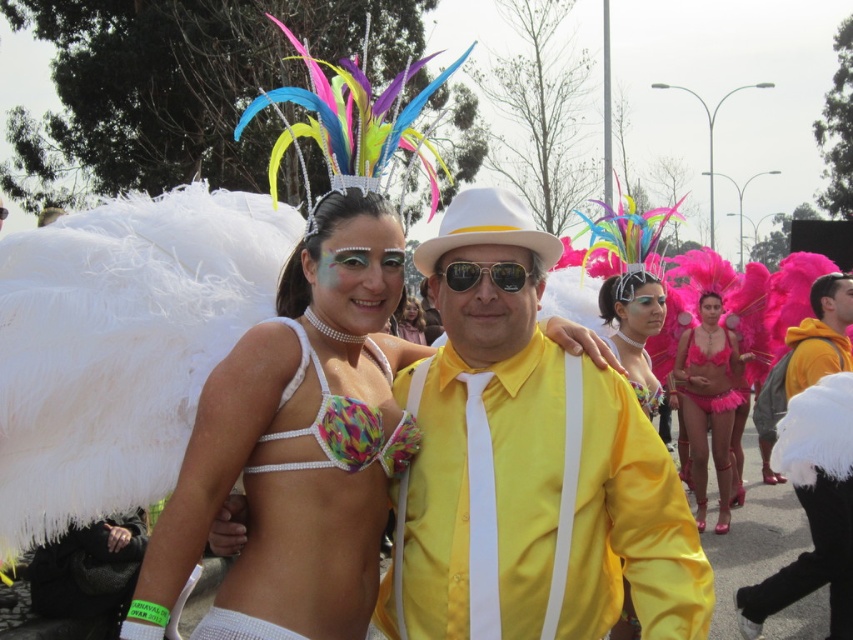
You are a photographer at the carnival and want to take a closeup shot of the fuzzy pink bikini at center and the sunglasses at center. Which one is closer to the camera?

The fuzzy pink bikini at center is closer to the camera than the sunglasses at center because it is further to the viewer than the sunglasses at center.

You are a photographer at the carnival trying to capture a photo of the fuzzy pink bikini at center and the sunglasses at center. If you want to ensure both objects are fully visible in your frame, which object requires more horizontal space in the camera viewfinder?

The fuzzy pink bikini at center requires more horizontal space in the camera viewfinder because its width surpasses that of the sunglasses at center.

You are a photographer trying to capture the perfect shot of the matte pink feathers at center. Based on their position, where should you aim your camera?

The matte pink feathers at center are located at the coordinates point (634,328), so you should aim your camera at that specific point to capture them perfectly.